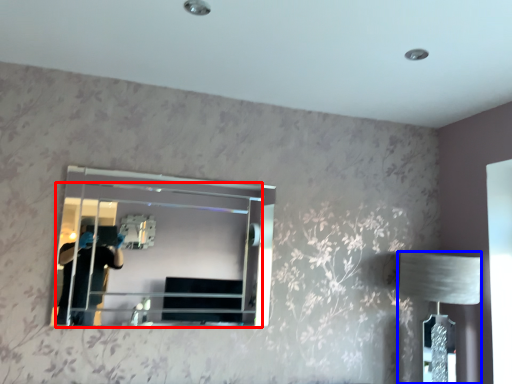
Question: Which object is further to the camera taking this photo, mirror (highlighted by a red box) or table lamp (highlighted by a blue box)?

Choices:
 (A) mirror
 (B) table lamp

Answer: (B)